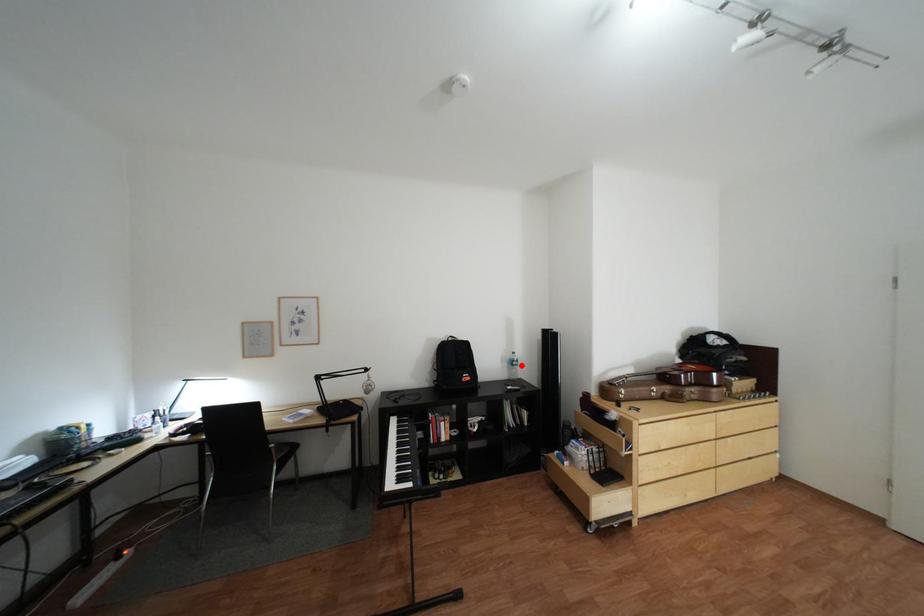
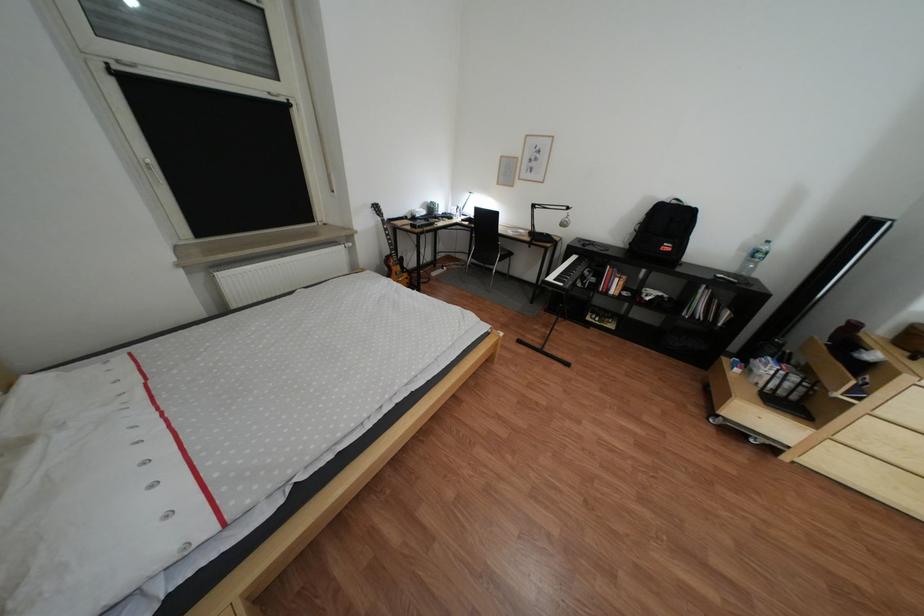
Locate, in the second image, the point that corresponds to the highlighted location in the first image.

(760, 256)